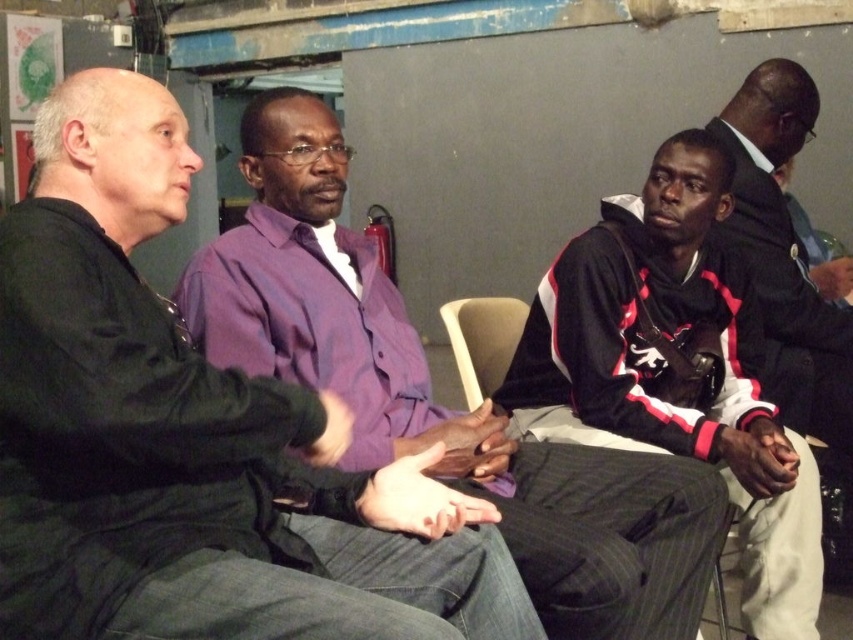
In the image of the group discussion, where exactly is the black jersey at center located in terms of coordinates?

The black jersey at center is located at coordinates point (674, 371).

Based on the coordinates provided, which object is located at point (x=431, y=396)?

The point (x=431, y=396) is located on the purple button down shirt at center.

You are organizing a charity event and need to hang two items on a wall. The wall has a space that can only accommodate an item wider than the black leather jacket at right. Do you think the black jersey at center will fit in that space?

The black jersey at center is wider than the black leather jacket at right, so it will fit in the space that requires an item wider than the black leather jacket at right.